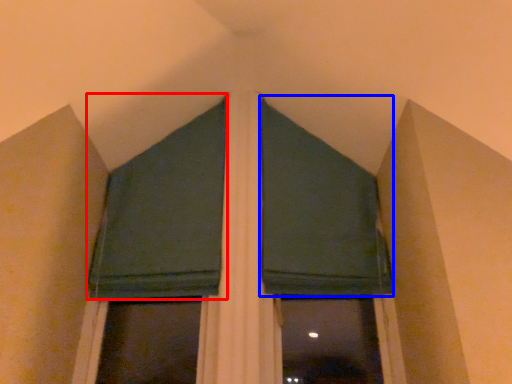
Question: Which object is closer to the camera taking this photo, curtain (highlighted by a red box) or curtain (highlighted by a blue box)?

Choices:
 (A) curtain
 (B) curtain

Answer: (A)